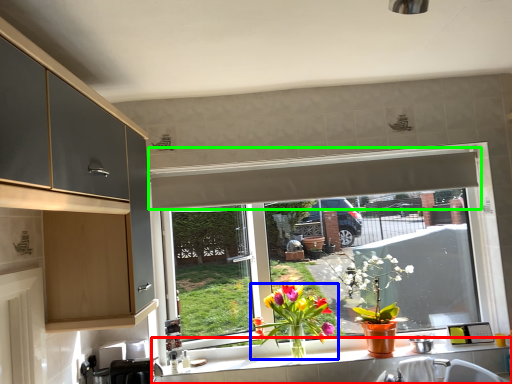
Question: Which is nearer to the countertop (highlighted by a red box)? houseplant (highlighted by a blue box) or exhaust hood (highlighted by a green box).

Choices:
 (A) houseplant
 (B) exhaust hood

Answer: (A)